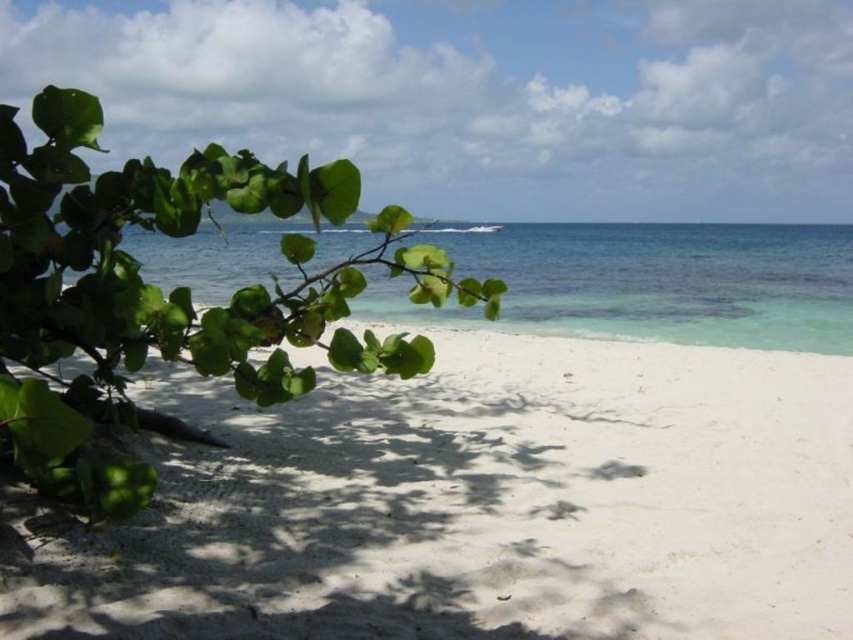
Question: Which point is farther from the camera taking this photo?

Choices:
 (A) (648, 307)
 (B) (561, 376)

Answer: (A)

Question: Is white sandy beach at center in front of clear blue water at center?

Choices:
 (A) yes
 (B) no

Answer: (A)

Question: Which object is closer to the camera taking this photo?

Choices:
 (A) green leafy branch at left
 (B) clear blue water at center
 (C) white sandy beach at center

Answer: (A)

Question: Does white sandy beach at center have a greater width compared to green leafy branch at left?

Choices:
 (A) yes
 (B) no

Answer: (A)

Question: Can you confirm if green leafy branch at left is positioned above clear blue water at center?

Choices:
 (A) yes
 (B) no

Answer: (B)

Question: Which is farther from the white sandy beach at center?

Choices:
 (A) clear blue water at center
 (B) green leafy branch at left

Answer: (A)